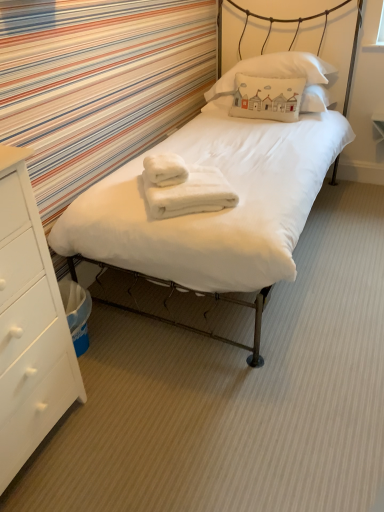
Looking at this image, what is the approximate width of white cotton pillow at upper center, which is counted as the first pillow, starting from the top?

white cotton pillow at upper center, which is counted as the first pillow, starting from the top, is 18.58 inches wide.

Locate an element on the screen. The width and height of the screenshot is (384, 512). white wood chest of drawers at lower left is located at coordinates (29, 325).

Describe the element at coordinates (29, 325) in the screenshot. I see `white wood chest of drawers at lower left` at that location.

Measure the distance between white cotton pillow at center, which is counted as the first pillow, starting from the bottom, and camera.

white cotton pillow at center, which is counted as the first pillow, starting from the bottom, and camera are 8.50 feet apart from each other.

Find the location of a particular element. white cotton pillow at upper center, which is counted as the first pillow, starting from the top is located at coordinates (276, 77).

Between white soft towel at center, which appears as the 2th bath towel when viewed from the right, and white soft towel at center, the first bath towel in the right-to-left sequence, which one has smaller size?

white soft towel at center, which appears as the 2th bath towel when viewed from the right, is smaller.

From their relative heights in the image, would you say white soft towel at center, which ranks as the 1th bath towel in left-to-right order, is taller or shorter than white soft towel at center, positioned as the 2th bath towel in left-to-right order?

In the image, white soft towel at center, which ranks as the 1th bath towel in left-to-right order, appears to be shorter than white soft towel at center, positioned as the 2th bath towel in left-to-right order.

Measure the distance from white soft towel at center, which ranks as the 1th bath towel in left-to-right order, to white soft towel at center, the first bath towel in the right-to-left sequence.

white soft towel at center, which ranks as the 1th bath towel in left-to-right order, and white soft towel at center, the first bath towel in the right-to-left sequence, are 7.66 centimeters apart.

Is white soft towel at center, which appears as the 2th bath towel when viewed from the right, to the left of white soft towel at center, positioned as the 2th bath towel in left-to-right order, from the viewer's perspective?

Yes.

From the image's perspective, between white wood chest of drawers at lower left and white soft towel at center, which appears as the 2th bath towel when viewed from the right, who is located below?

white wood chest of drawers at lower left appears lower in the image.

Is white soft towel at center, which ranks as the 1th bath towel in left-to-right order, at the back of white wood chest of drawers at lower left?

white wood chest of drawers at lower left does not have its back to white soft towel at center, which ranks as the 1th bath towel in left-to-right order.

Between white wood chest of drawers at lower left and white soft towel at center, which appears as the 2th bath towel when viewed from the right, which one has less height?

With less height is white soft towel at center, which appears as the 2th bath towel when viewed from the right.

Measure the distance between white wood chest of drawers at lower left and white soft towel at center, which ranks as the 1th bath towel in left-to-right order.

white wood chest of drawers at lower left is 32.51 inches away from white soft towel at center, which ranks as the 1th bath towel in left-to-right order.

Is white matte bed at center looking in the opposite direction of white soft towel at center, the first bath towel in the right-to-left sequence?

No, white matte bed at center is not facing the opposite direction of white soft towel at center, the first bath towel in the right-to-left sequence.

Looking at this image, considering the relative sizes of white matte bed at center and white soft towel at center, positioned as the 2th bath towel in left-to-right order, in the image provided, is white matte bed at center wider than white soft towel at center, positioned as the 2th bath towel in left-to-right order,?

Correct, the width of white matte bed at center exceeds that of white soft towel at center, positioned as the 2th bath towel in left-to-right order.

From the picture: Could white soft towel at center, positioned as the 2th bath towel in left-to-right order, be considered to be inside white matte bed at center?

Yes, white soft towel at center, positioned as the 2th bath towel in left-to-right order, is inside white matte bed at center.

From the image's perspective, is white soft towel at center, the first bath towel in the right-to-left sequence, located above or below white wood chest of drawers at lower left?

Clearly, from the image's perspective, white soft towel at center, the first bath towel in the right-to-left sequence, is above white wood chest of drawers at lower left.

Based on the photo, considering the sizes of objects white soft towel at center, the first bath towel in the right-to-left sequence, and white wood chest of drawers at lower left in the image provided, who is wider, white soft towel at center, the first bath towel in the right-to-left sequence, or white wood chest of drawers at lower left?

white wood chest of drawers at lower left is wider.

Is white soft towel at center, positioned as the 2th bath towel in left-to-right order, next to white wood chest of drawers at lower left?

No, white soft towel at center, positioned as the 2th bath towel in left-to-right order, is not in contact with white wood chest of drawers at lower left.

Choose the correct answer: Is white soft towel at center, the first bath towel in the right-to-left sequence, inside white wood chest of drawers at lower left or outside it?

white soft towel at center, the first bath towel in the right-to-left sequence, is not enclosed by white wood chest of drawers at lower left.

Between white cotton pillow at upper center, which is counted as the first pillow, starting from the top, and white cotton pillow at center, arranged as the 2th pillow when viewed from the top, which one has larger size?

white cotton pillow at upper center, which is counted as the first pillow, starting from the top, is bigger.

Which point is more distant from viewer, (224,86) or (231,111)?

The point (224,86) is more distant.

What are the coordinates of `pillow that appears on the right of white cotton pillow at center, arranged as the 2th pillow when viewed from the top` in the screenshot? It's located at (276, 77).

Who is shorter, white soft towel at center, which appears as the 2th bath towel when viewed from the right, or white cotton pillow at center, which is counted as the first pillow, starting from the bottom?

With less height is white soft towel at center, which appears as the 2th bath towel when viewed from the right.

From the image's perspective, is white soft towel at center, which ranks as the 1th bath towel in left-to-right order, positioned above or below white cotton pillow at center, which is counted as the first pillow, starting from the bottom?

white soft towel at center, which ranks as the 1th bath towel in left-to-right order, is situated lower than white cotton pillow at center, which is counted as the first pillow, starting from the bottom, in the image.

Between white soft towel at center, which ranks as the 1th bath towel in left-to-right order, and white cotton pillow at center, arranged as the 2th pillow when viewed from the top, which one appears on the right side from the viewer's perspective?

white cotton pillow at center, arranged as the 2th pillow when viewed from the top.

Which object is wider, white soft towel at center, which appears as the 2th bath towel when viewed from the right, or white cotton pillow at center, arranged as the 2th pillow when viewed from the top?

Wider between the two is white soft towel at center, which appears as the 2th bath towel when viewed from the right.

Is white matte bed at center with white wood chest of drawers at lower left?

No, white matte bed at center is not in contact with white wood chest of drawers at lower left.

At what (x,y) coordinates should I click in order to perform the action: click on bed located on the right of white wood chest of drawers at lower left. Please return your answer as a coordinate pair (x, y). This screenshot has height=512, width=384. Looking at the image, I should click on (231, 184).

From a real-world perspective, which is physically below, white matte bed at center or white wood chest of drawers at lower left?

white wood chest of drawers at lower left, from a real-world perspective.

Does white matte bed at center turn towards white wood chest of drawers at lower left?

Yes, white matte bed at center faces towards white wood chest of drawers at lower left.

Locate an element on the screen. bath towel to the left of white soft towel at center, the first bath towel in the right-to-left sequence is located at coordinates (165, 169).

Locate an element on the screen. The width and height of the screenshot is (384, 512). the 2nd bath towel above the white wood chest of drawers at lower left (from the image's perspective) is located at coordinates (165, 169).

Estimate the real-world distances between objects in this image. Which object is closer to white soft towel at center, which ranks as the 1th bath towel in left-to-right order, white soft towel at center, positioned as the 2th bath towel in left-to-right order, or white cotton pillow at upper center, which is counted as the first pillow, starting from the top?

Based on the image, white soft towel at center, positioned as the 2th bath towel in left-to-right order, appears to be nearer to white soft towel at center, which ranks as the 1th bath towel in left-to-right order.

Looking at the image, which one is located closer to white soft towel at center, which ranks as the 1th bath towel in left-to-right order, white wood chest of drawers at lower left or white cotton pillow at upper center, which is the second pillow in bottom-to-top order?

white wood chest of drawers at lower left lies closer to white soft towel at center, which ranks as the 1th bath towel in left-to-right order, than the other object.

Estimate the real-world distances between objects in this image. Which object is further from white soft towel at center, positioned as the 2th bath towel in left-to-right order, white cotton pillow at upper center, which is the second pillow in bottom-to-top order, or white cotton pillow at center, arranged as the 2th pillow when viewed from the top?

The object further to white soft towel at center, positioned as the 2th bath towel in left-to-right order, is white cotton pillow at upper center, which is the second pillow in bottom-to-top order.

Which object lies further to the anchor point white matte bed at center, white wood chest of drawers at lower left or white soft towel at center, the first bath towel in the right-to-left sequence?

Based on the image, white wood chest of drawers at lower left appears to be further to white matte bed at center.

When comparing their distances from white cotton pillow at upper center, which is the second pillow in bottom-to-top order, does white matte bed at center or white soft towel at center, the first bath towel in the right-to-left sequence, seem further?

Among the two, white soft towel at center, the first bath towel in the right-to-left sequence, is located further to white cotton pillow at upper center, which is the second pillow in bottom-to-top order.

When comparing their distances from white cotton pillow at center, arranged as the 2th pillow when viewed from the top, does white soft towel at center, which appears as the 2th bath towel when viewed from the right, or white wood chest of drawers at lower left seem closer?

white soft towel at center, which appears as the 2th bath towel when viewed from the right.

Looking at the image, which one is located further to white wood chest of drawers at lower left, white cotton pillow at upper center, which is the second pillow in bottom-to-top order, or white soft towel at center, the first bath towel in the right-to-left sequence?

The object further to white wood chest of drawers at lower left is white cotton pillow at upper center, which is the second pillow in bottom-to-top order.

Considering their positions, is white soft towel at center, which ranks as the 1th bath towel in left-to-right order, positioned further to white cotton pillow at center, which is counted as the first pillow, starting from the bottom, than white soft towel at center, the first bath towel in the right-to-left sequence?

Among the two, white soft towel at center, the first bath towel in the right-to-left sequence, is located further to white cotton pillow at center, which is counted as the first pillow, starting from the bottom.

This screenshot has height=512, width=384. I want to click on bath towel between white cotton pillow at upper center, which is the second pillow in bottom-to-top order, and white soft towel at center, the first bath towel in the right-to-left sequence, in the up-down direction, so click(165, 169).

Find the location of a particular element. The height and width of the screenshot is (512, 384). bath towel between white matte bed at center and white soft towel at center, which appears as the 2th bath towel when viewed from the right, along the z-axis is located at coordinates (184, 187).

The image size is (384, 512). I want to click on pillow between white wood chest of drawers at lower left and white cotton pillow at center, which is counted as the first pillow, starting from the bottom, in the front-back direction, so click(276, 77).

At what (x,y) coordinates should I click in order to perform the action: click on bath towel located between white wood chest of drawers at lower left and white soft towel at center, which appears as the 2th bath towel when viewed from the right, in the depth direction. Please return your answer as a coordinate pair (x, y). This screenshot has width=384, height=512. Looking at the image, I should click on (184, 187).